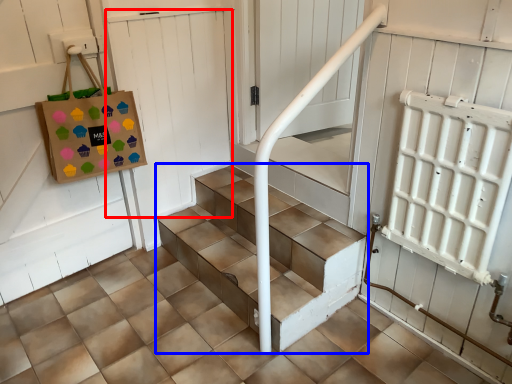
Question: Which object is further to the camera taking this photo, door (highlighted by a red box) or stairs (highlighted by a blue box)?

Choices:
 (A) door
 (B) stairs

Answer: (A)